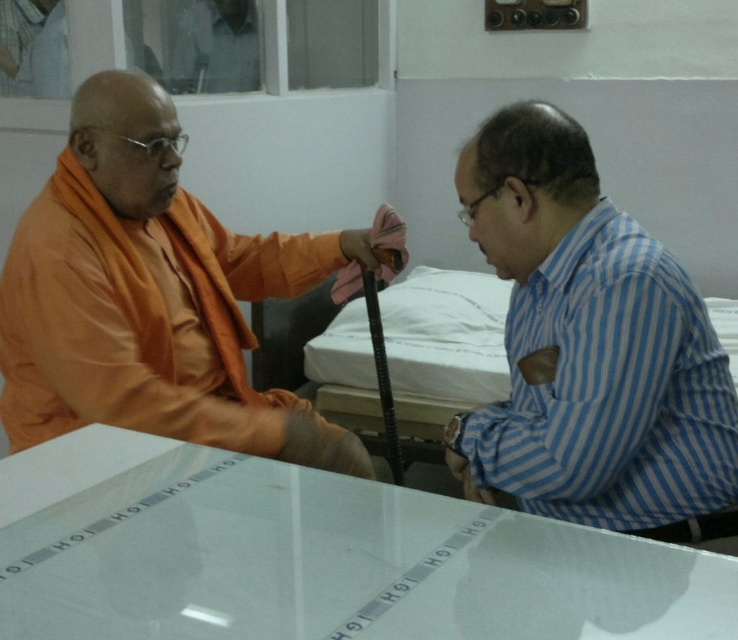
Question: Which of the following is the farthest from the observer?

Choices:
 (A) orange silk monk at left
 (B) transparent glass table at center

Answer: (A)

Question: Which point is farther from the camera taking this photo?

Choices:
 (A) pos(596,244)
 (B) pos(89,477)
 (C) pos(108,310)

Answer: (C)

Question: In this image, where is transparent glass table at center located relative to orange silk monk at left?

Choices:
 (A) right
 (B) left

Answer: (A)

Question: Which of the following is the closest to the observer?

Choices:
 (A) transparent glass table at center
 (B) orange silk monk at left

Answer: (A)

Question: Can you confirm if orange silk monk at left is smaller than blue striped shirt at right?

Choices:
 (A) yes
 (B) no

Answer: (B)

Question: From the image, what is the correct spatial relationship of transparent glass table at center in relation to blue striped shirt at right?

Choices:
 (A) right
 (B) left

Answer: (B)